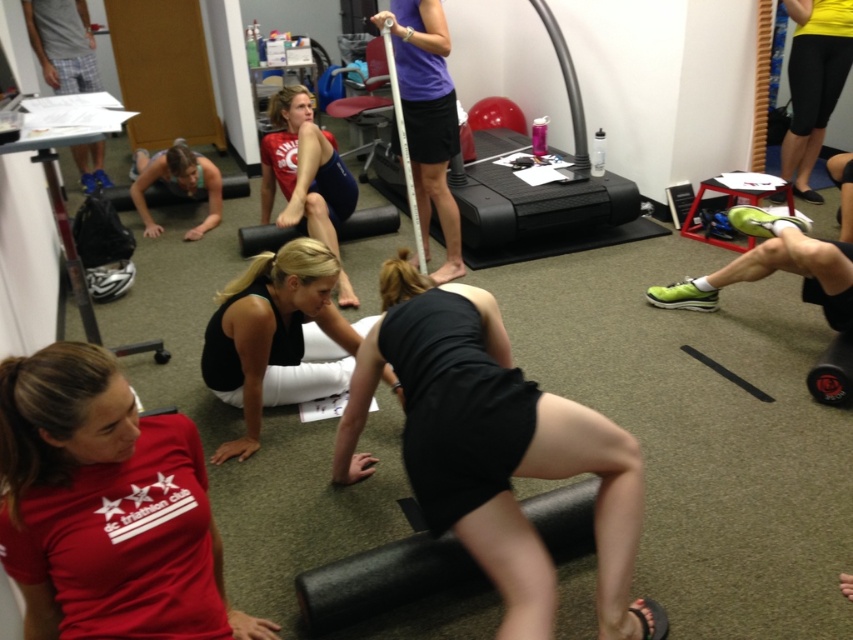
Consider the image. Who is taller, black matte shorts at center or blue plaid shorts at upper left?

With more height is black matte shorts at center.

Is the position of black matte shorts at center more distant than that of blue plaid shorts at upper left?

No.

Who is more distant from viewer, [445,524] or [50,28]?

The point [50,28] is more distant.

Image resolution: width=853 pixels, height=640 pixels. In order to click on black matte shorts at center in this screenshot , I will do `click(498, 456)`.

Is yellow matte shorts at upper right closer to camera compared to blue plaid shorts at upper left?

Yes, it is.

Is yellow matte shorts at upper right above blue plaid shorts at upper left?

Actually, yellow matte shorts at upper right is below blue plaid shorts at upper left.

Measure the distance between point (796,104) and camera.

Point (796,104) and camera are 13.97 feet apart.

Locate an element on the screen. yellow matte shorts at upper right is located at coordinates (813, 83).

Between red matte shirt at center and black matte shorts at center, which one is positioned lower?

red matte shirt at center is below.

Can you confirm if red matte shirt at center is positioned above black matte shorts at center?

Incorrect, red matte shirt at center is not positioned above black matte shorts at center.

This screenshot has width=853, height=640. I want to click on red matte shirt at center, so click(106, 508).